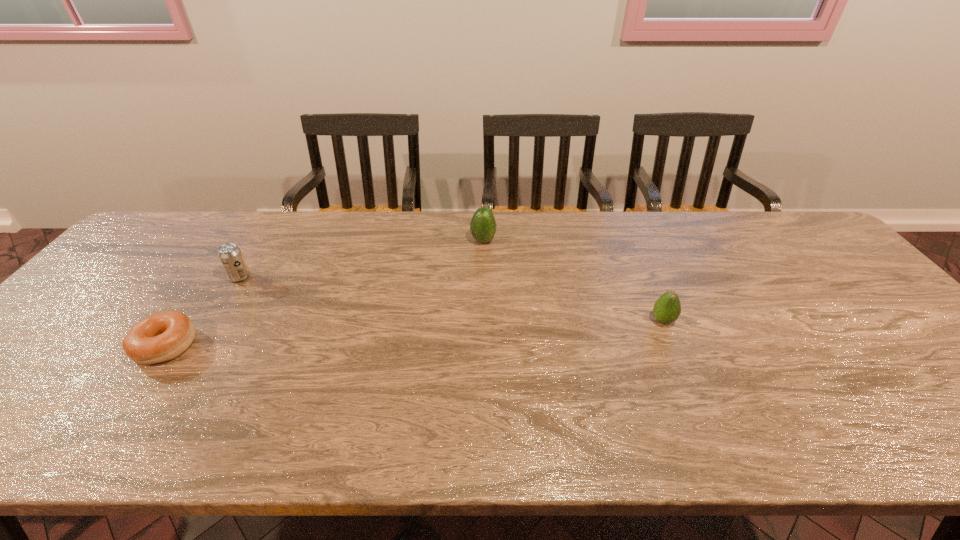
The height and width of the screenshot is (540, 960). I want to click on unoccupied position between the bagel and the beer can, so point(203,312).

Locate an element on the screen. free space between the shorter avocado and the shortest object is located at coordinates (414, 333).

I want to click on empty location between the rightmost object and the third object from left to right, so click(573, 281).

You are a GUI agent. You are given a task and a screenshot of the screen. Output one action in this format:
    pyautogui.click(x=<x>, y=<y>)
    Task: Click on the unoccupied area between the beer can and the rightmost object
    
    Given the screenshot: What is the action you would take?
    pyautogui.click(x=451, y=299)

Where is `the third closest object relative to the third nearest object`? Image resolution: width=960 pixels, height=540 pixels. the third closest object relative to the third nearest object is located at coordinates (667, 308).

Identify the location of object that stands as the third closest to the shortest object. This screenshot has width=960, height=540. (667, 308).

This screenshot has width=960, height=540. In order to click on vacant region that satisfies the following two spatial constraints: 1. on the back side of the shortest object; 2. on the left side of the third nearest object in this screenshot , I will do `click(213, 277)`.

The width and height of the screenshot is (960, 540). What are the coordinates of `free spot that satisfies the following two spatial constraints: 1. on the front side of the left avocado; 2. on the left side of the right avocado` in the screenshot? It's located at pyautogui.click(x=484, y=321).